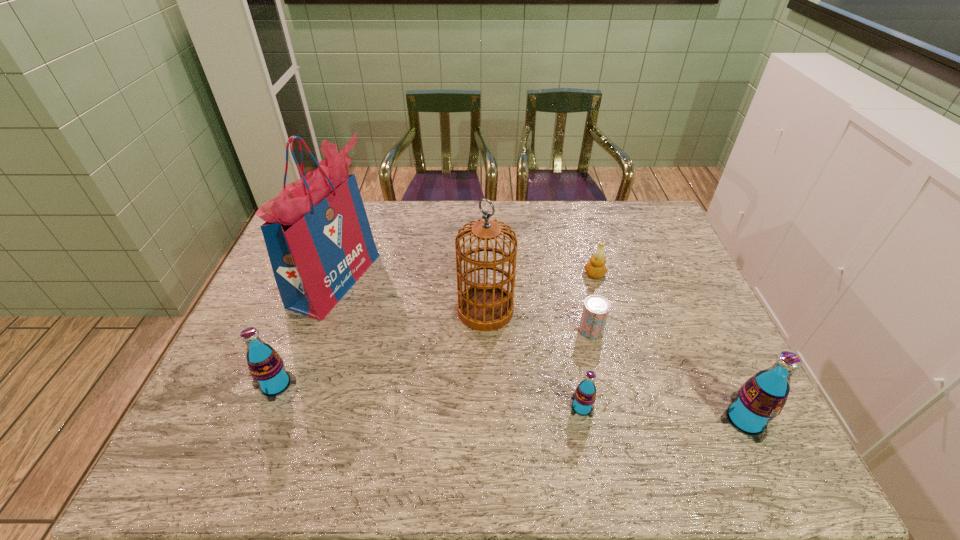
Where is `object that is at the near left corner`? object that is at the near left corner is located at coordinates [266, 367].

Locate an element on the screen. object present at the near right corner is located at coordinates (x=761, y=398).

Locate an element on the screen. vacant point at the far edge is located at coordinates (396, 231).

I want to click on vacant space at the near edge of the desktop, so click(x=388, y=397).

The width and height of the screenshot is (960, 540). What are the coordinates of `blank space at the right edge of the desktop` in the screenshot? It's located at (665, 335).

The width and height of the screenshot is (960, 540). In order to click on vacant space at the far right corner of the desktop in this screenshot , I will do `click(636, 217)`.

Where is `vacant space at the near right corner of the desktop`? vacant space at the near right corner of the desktop is located at coordinates (711, 415).

Find the location of `free space between the leftmost soda and the tallest object`. free space between the leftmost soda and the tallest object is located at coordinates (305, 332).

This screenshot has width=960, height=540. Identify the location of free spot between the rightmost object and the fourth object from left to right. (663, 413).

Find the location of a particular element. This screenshot has width=960, height=540. vacant space in between the second tallest object and the rightmost object is located at coordinates (615, 364).